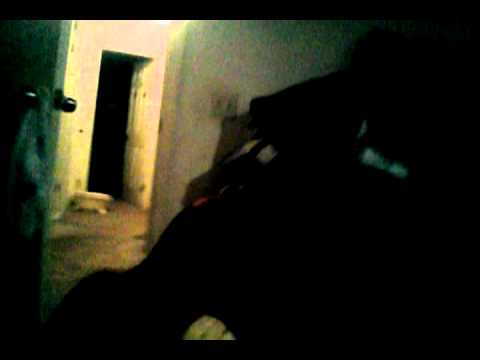
The height and width of the screenshot is (360, 480). In order to click on floor in this screenshot , I will do `click(93, 200)`.